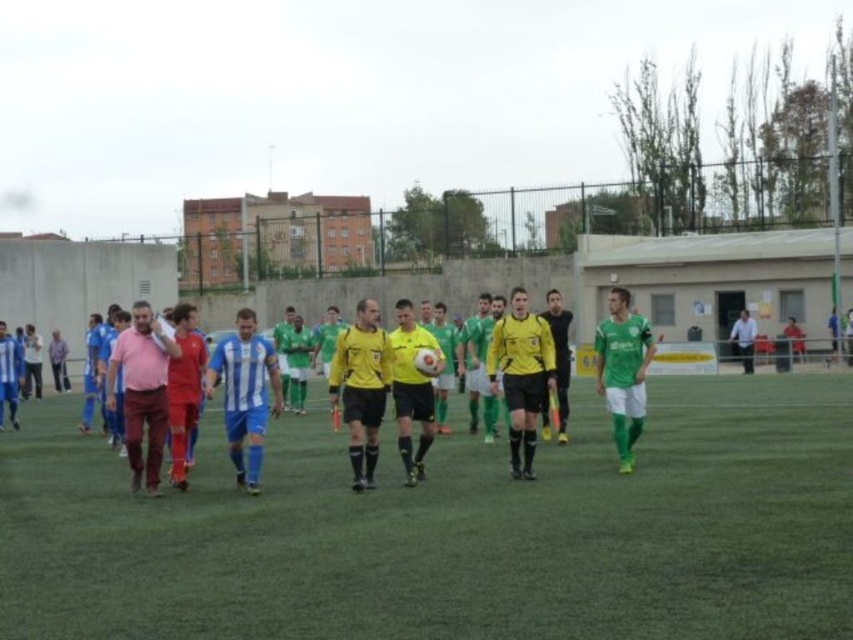
Looking at this image, is green jersey at center wider than pink matte shirt at center?

Yes, green jersey at center is wider than pink matte shirt at center.

Between green jersey at center and pink matte shirt at center, which one appears on the left side from the viewer's perspective?

Positioned to the left is pink matte shirt at center.

Locate an element on the screen. green jersey at center is located at coordinates (383, 388).

Where is `green artificial turf at center`? The image size is (853, 640). green artificial turf at center is located at coordinates (453, 531).

Can you confirm if green artificial turf at center is positioned above pink matte shirt at center?

Incorrect, green artificial turf at center is not positioned above pink matte shirt at center.

Image resolution: width=853 pixels, height=640 pixels. Identify the location of green artificial turf at center. (453, 531).

Can you confirm if pink matte shirt at center is bigger than yellow matte jersey at center?

Actually, pink matte shirt at center might be smaller than yellow matte jersey at center.

Between pink matte shirt at center and yellow matte jersey at center, which one appears on the left side from the viewer's perspective?

pink matte shirt at center

Where is `pink matte shirt at center`? This screenshot has height=640, width=853. pink matte shirt at center is located at coordinates (142, 388).